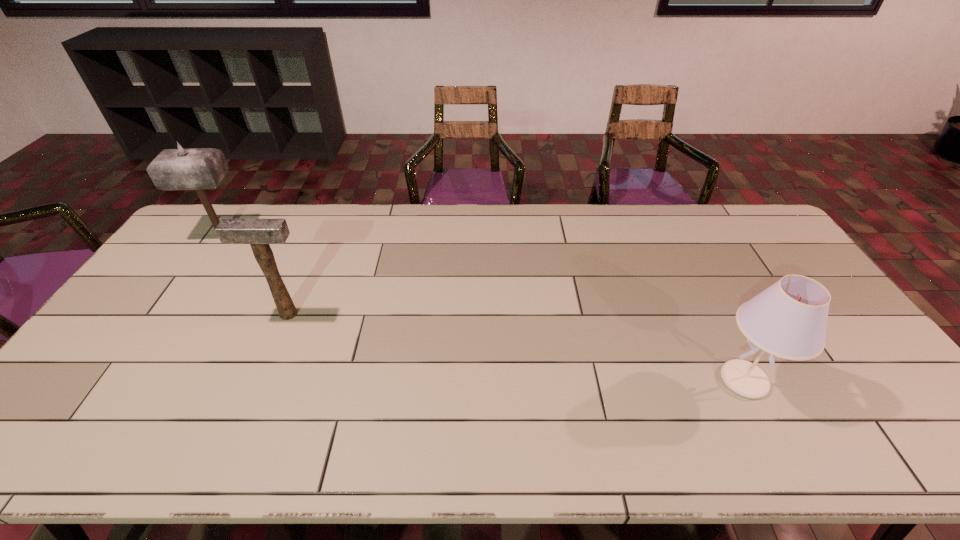
Locate an element on the screen. object located in the left edge section of the desktop is located at coordinates (198, 169).

Where is `object that is at the far left corner`? object that is at the far left corner is located at coordinates (198, 169).

Where is `vacant area at the far edge`? This screenshot has width=960, height=540. vacant area at the far edge is located at coordinates (461, 211).

This screenshot has width=960, height=540. I want to click on vacant space at the near edge of the desktop, so click(429, 432).

The image size is (960, 540). Find the location of `free space at the left edge`. free space at the left edge is located at coordinates (190, 285).

At what (x,y) coordinates should I click in order to perform the action: click on vacant space at the right edge of the desktop. Please return your answer as a coordinate pair (x, y). The height and width of the screenshot is (540, 960). Looking at the image, I should click on (821, 368).

The image size is (960, 540). Identify the location of free location at the near left corner of the desktop. (42, 446).

Identify the location of empty space that is in between the leftmost object and the second object from right to left. The width and height of the screenshot is (960, 540). (255, 275).

Identify the location of vacant area that lies between the right mallet and the left mallet. The width and height of the screenshot is (960, 540). (255, 275).

In order to click on free area in between the farthest object and the nearest object in this screenshot , I will do `click(483, 308)`.